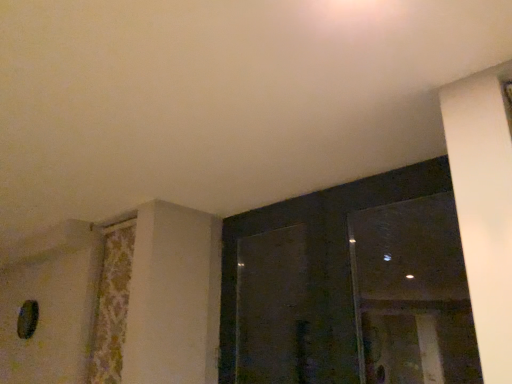
Question: Is floral fabric curtain at left closer to camera compared to transparent glass window at upper right, acting as the second window starting from the left?

Choices:
 (A) no
 (B) yes

Answer: (A)

Question: From the image's perspective, does floral fabric curtain at left appear higher than transparent glass window at upper right, acting as the second window starting from the left?

Choices:
 (A) yes
 (B) no

Answer: (B)

Question: Does floral fabric curtain at left have a greater height compared to transparent glass window at upper right, acting as the second window starting from the left?

Choices:
 (A) yes
 (B) no

Answer: (A)

Question: Does floral fabric curtain at left come behind transparent glass window at upper right, acting as the second window starting from the left?

Choices:
 (A) yes
 (B) no

Answer: (A)

Question: Does floral fabric curtain at left appear on the left side of transparent glass window at upper right, the 1th window viewed from the right?

Choices:
 (A) yes
 (B) no

Answer: (A)

Question: Can you confirm if floral fabric curtain at left is shorter than transparent glass window at upper right, acting as the second window starting from the left?

Choices:
 (A) yes
 (B) no

Answer: (B)

Question: From a real-world perspective, does transparent glass window at upper right, the 1th window viewed from the right, sit lower than transparent glass window at upper right, acting as the first window starting from the left?

Choices:
 (A) no
 (B) yes

Answer: (A)

Question: Could you tell me if transparent glass window at upper right, the 1th window viewed from the right, is turned towards transparent glass window at upper right, acting as the first window starting from the left?

Choices:
 (A) no
 (B) yes

Answer: (B)

Question: Can you confirm if transparent glass window at upper right, the 1th window viewed from the right, is smaller than transparent glass window at upper right, arranged as the second window when viewed from the right?

Choices:
 (A) yes
 (B) no

Answer: (A)

Question: Is transparent glass window at upper right, the 1th window viewed from the right, at the right side of transparent glass window at upper right, arranged as the second window when viewed from the right?

Choices:
 (A) yes
 (B) no

Answer: (A)

Question: Does transparent glass window at upper right, acting as the second window starting from the left, have a lesser width compared to transparent glass window at upper right, acting as the first window starting from the left?

Choices:
 (A) yes
 (B) no

Answer: (A)

Question: Is transparent glass window at upper right, the 1th window viewed from the right, positioned in front of transparent glass window at upper right, acting as the first window starting from the left?

Choices:
 (A) yes
 (B) no

Answer: (B)

Question: Would you consider transparent glass screen door at center to be distant from transparent glass window at upper right, arranged as the second window when viewed from the right?

Choices:
 (A) no
 (B) yes

Answer: (A)